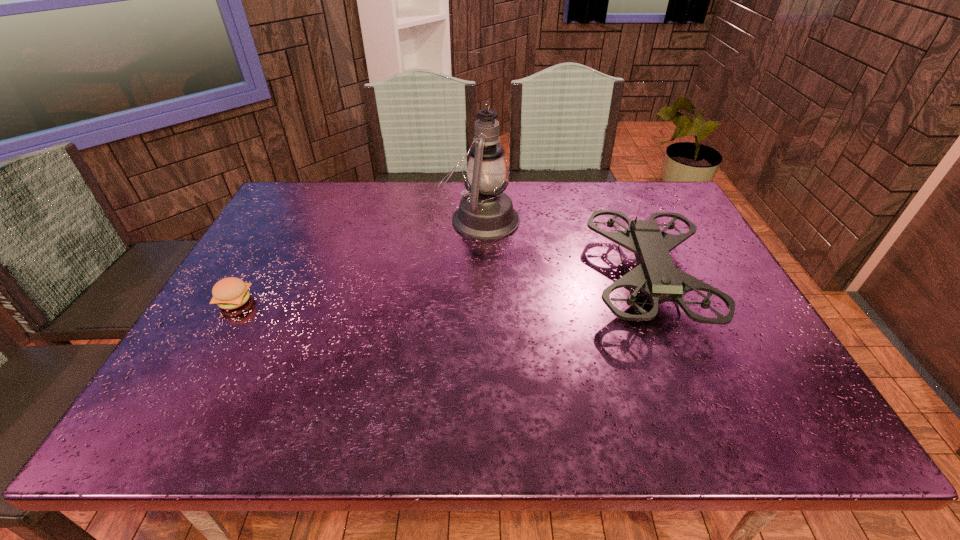
Locate an element on the screen. The image size is (960, 540). free space that satisfies the following two spatial constraints: 1. on the back side of the oil lamp; 2. on the left side of the leftmost object is located at coordinates (282, 219).